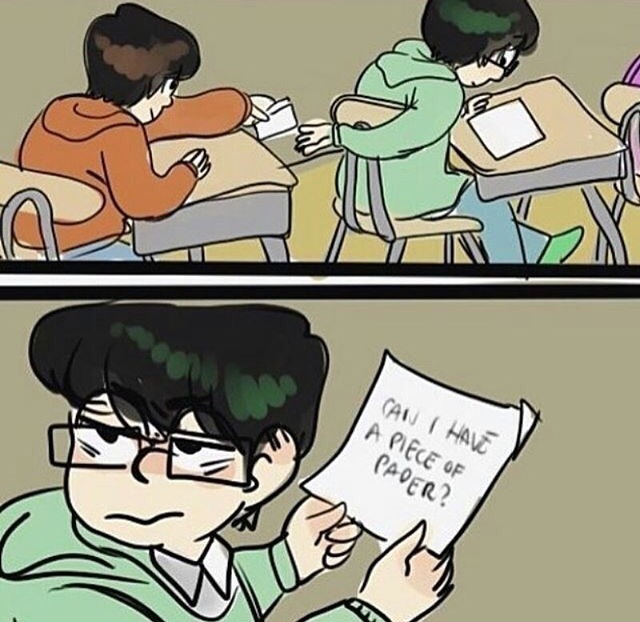
Image resolution: width=640 pixels, height=622 pixels. What are the coordinates of `desk` in the screenshot? It's located at (250, 178), (538, 132).